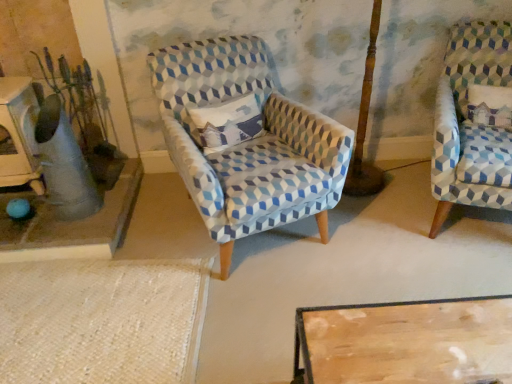
The image size is (512, 384). I want to click on vacant space in blue-patterned fabric chair at right, positioned as the first chair in right-to-left order (from a real-world perspective), so 464,219.